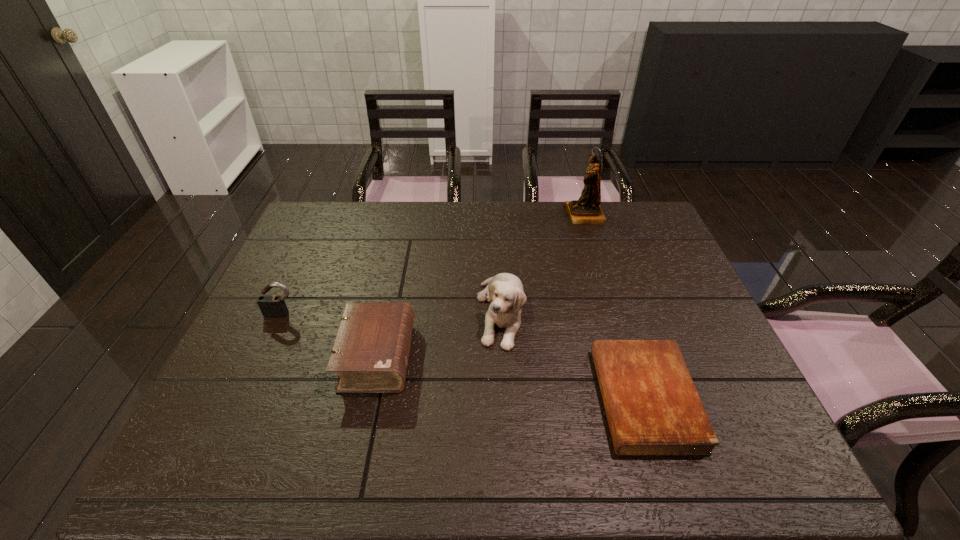
Locate an element on the screen. empty space that is in between the shortest object and the puppy is located at coordinates (573, 355).

This screenshot has height=540, width=960. Find the location of `free space between the tallest object and the third object from right to left`. free space between the tallest object and the third object from right to left is located at coordinates (542, 264).

Identify the location of empty location between the right Bible and the puppy. (573, 355).

Locate an element on the screen. blank region between the third object from right to left and the fourth tallest object is located at coordinates tap(439, 335).

Locate an element on the screen. The image size is (960, 540). unoccupied position between the tallest object and the third shortest object is located at coordinates (433, 265).

The image size is (960, 540). Identify the location of empty space between the taller Bible and the shorter Bible. (511, 377).

The image size is (960, 540). In order to click on free space between the second tallest object and the second shortest object in this screenshot , I will do `click(439, 335)`.

Locate which object is the fourth closest to the shortest object. Please provide its 2D coordinates. Your answer should be formatted as a tuple, i.e. [(x, y)], where the tuple contains the x and y coordinates of a point satisfying the conditions above.

[(272, 306)]

This screenshot has height=540, width=960. In order to click on the third closest object relative to the left Bible in this screenshot , I will do `click(652, 406)`.

Identify the location of vacant space that satisfies the following two spatial constraints: 1. on the front-facing side of the tallest object; 2. on the front-facing side of the third object from right to left. The image size is (960, 540). (615, 313).